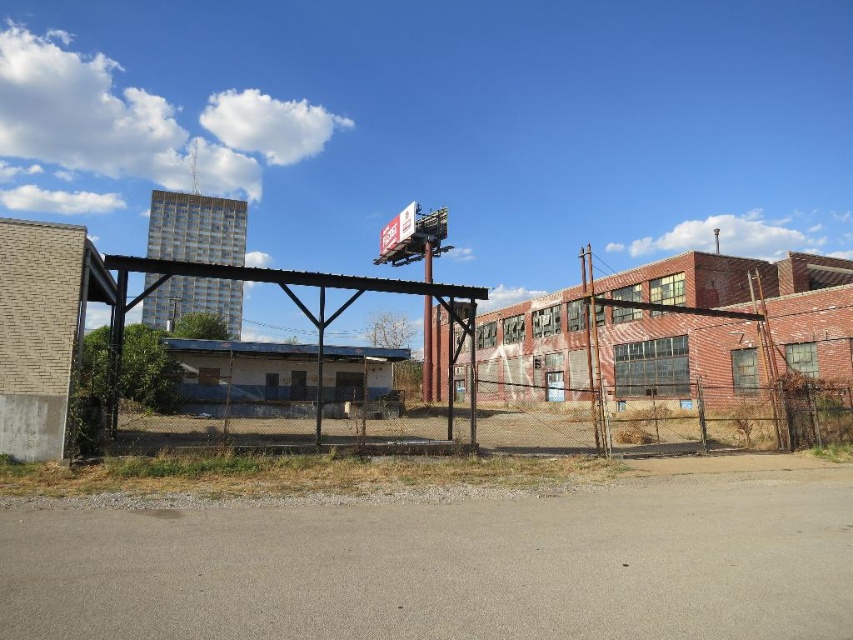
Question: From the image, what is the correct spatial relationship of rusty metal fence at center in relation to white plastic billboard at upper center?

Choices:
 (A) right
 (B) left

Answer: (A)

Question: Which point is closer to the camera?

Choices:
 (A) (428, 412)
 (B) (384, 228)

Answer: (A)

Question: Is rusty metal fence at center further to camera compared to white plastic billboard at upper center?

Choices:
 (A) yes
 (B) no

Answer: (B)

Question: Which point is farther from the camera taking this photo?

Choices:
 (A) (575, 444)
 (B) (403, 212)

Answer: (B)

Question: Does rusty metal fence at center have a lesser width compared to white plastic billboard at upper center?

Choices:
 (A) yes
 (B) no

Answer: (B)